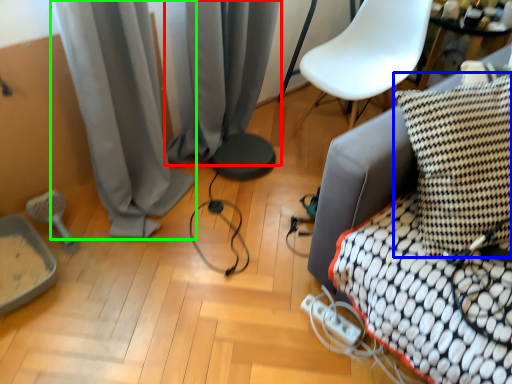
Question: Which is nearer to the curtain (highlighted by a red box)? pillow (highlighted by a blue box) or curtain (highlighted by a green box).

Choices:
 (A) pillow
 (B) curtain

Answer: (B)